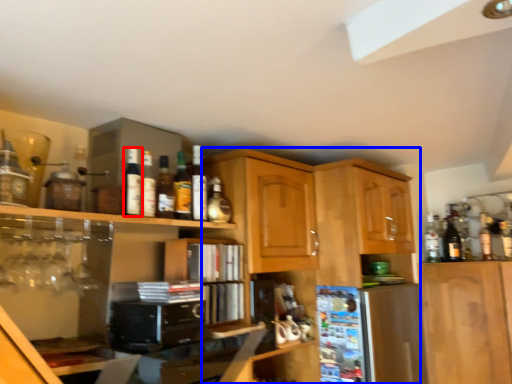
Question: Which object appears farthest to the camera in this image, bottle (highlighted by a red box) or cabinetry (highlighted by a blue box)?

Choices:
 (A) bottle
 (B) cabinetry

Answer: (B)